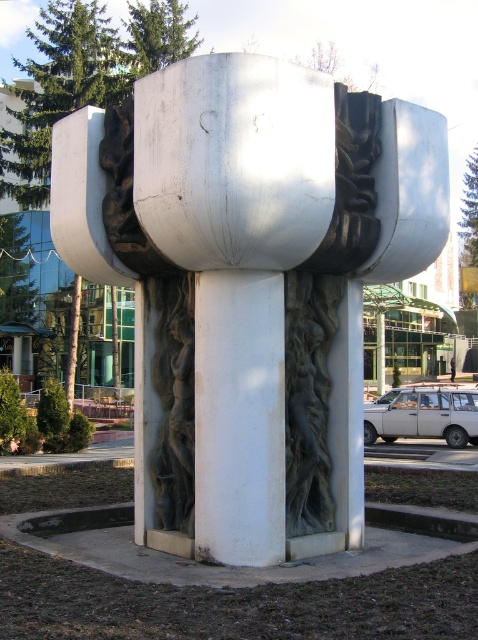
Question: Can you confirm if white polished stone sculpture at center is positioned to the left of white smooth pillar at center?

Choices:
 (A) no
 (B) yes

Answer: (A)

Question: Can you confirm if white polished stone sculpture at center is wider than white smooth pillar at center?

Choices:
 (A) yes
 (B) no

Answer: (A)

Question: Which of the following is the farthest from the observer?

Choices:
 (A) (274, 518)
 (B) (195, 474)

Answer: (B)

Question: Is white polished stone sculpture at center in front of white smooth pillar at center?

Choices:
 (A) no
 (B) yes

Answer: (B)